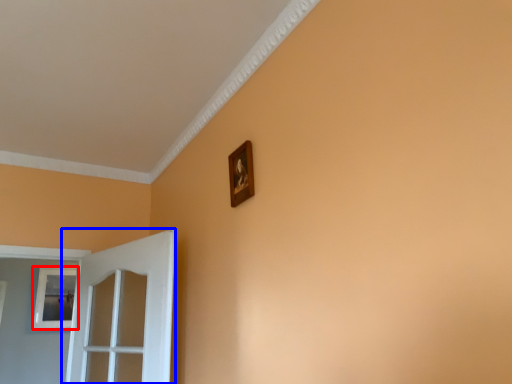
Question: Among these objects, which one is nearest to the camera, picture frame (highlighted by a red box) or door (highlighted by a blue box)?

Choices:
 (A) picture frame
 (B) door

Answer: (B)